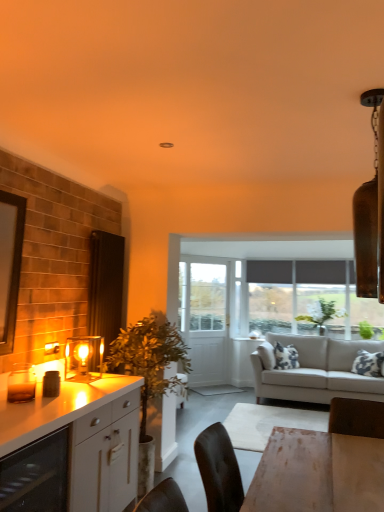
Question: Is light gray fabric couch at center completely or partially outside of white glossy cabinet at left?

Choices:
 (A) yes
 (B) no

Answer: (A)

Question: Does light gray fabric couch at center have a larger size compared to white glossy cabinet at left?

Choices:
 (A) yes
 (B) no

Answer: (A)

Question: From the image's perspective, is light gray fabric couch at center located above white glossy cabinet at left?

Choices:
 (A) no
 (B) yes

Answer: (A)

Question: Considering the relative positions of light gray fabric couch at center and white glossy cabinet at left in the image provided, is light gray fabric couch at center in front of white glossy cabinet at left?

Choices:
 (A) no
 (B) yes

Answer: (A)

Question: Considering the relative sizes of light gray fabric couch at center and white glossy cabinet at left in the image provided, is light gray fabric couch at center thinner than white glossy cabinet at left?

Choices:
 (A) no
 (B) yes

Answer: (A)

Question: From their relative heights in the image, would you say light gray fabric couch at center is taller or shorter than green leafy plant at upper center?

Choices:
 (A) short
 (B) tall

Answer: (B)

Question: In terms of size, does light gray fabric couch at center appear bigger or smaller than green leafy plant at upper center?

Choices:
 (A) big
 (B) small

Answer: (A)

Question: From the image's perspective, relative to green leafy plant at upper center, is light gray fabric couch at center above or below?

Choices:
 (A) below
 (B) above

Answer: (A)

Question: Is light gray fabric couch at center in front of or behind green leafy plant at upper center in the image?

Choices:
 (A) behind
 (B) front

Answer: (B)

Question: Does point (188, 290) appear closer or farther from the camera than point (112, 411)?

Choices:
 (A) farther
 (B) closer

Answer: (A)

Question: From a real-world perspective, is white wooden screen door at center physically located above or below white glossy cabinet at left?

Choices:
 (A) below
 (B) above

Answer: (B)

Question: Is white wooden screen door at center wider or thinner than white glossy cabinet at left?

Choices:
 (A) thin
 (B) wide

Answer: (A)

Question: Is white wooden screen door at center taller or shorter than white glossy cabinet at left?

Choices:
 (A) tall
 (B) short

Answer: (A)

Question: In terms of width, does green leafy plant at upper center look wider or thinner when compared to matte glass wine cooler at lower left?

Choices:
 (A) thin
 (B) wide

Answer: (A)

Question: Based on their sizes in the image, would you say green leafy plant at upper center is bigger or smaller than matte glass wine cooler at lower left?

Choices:
 (A) big
 (B) small

Answer: (A)